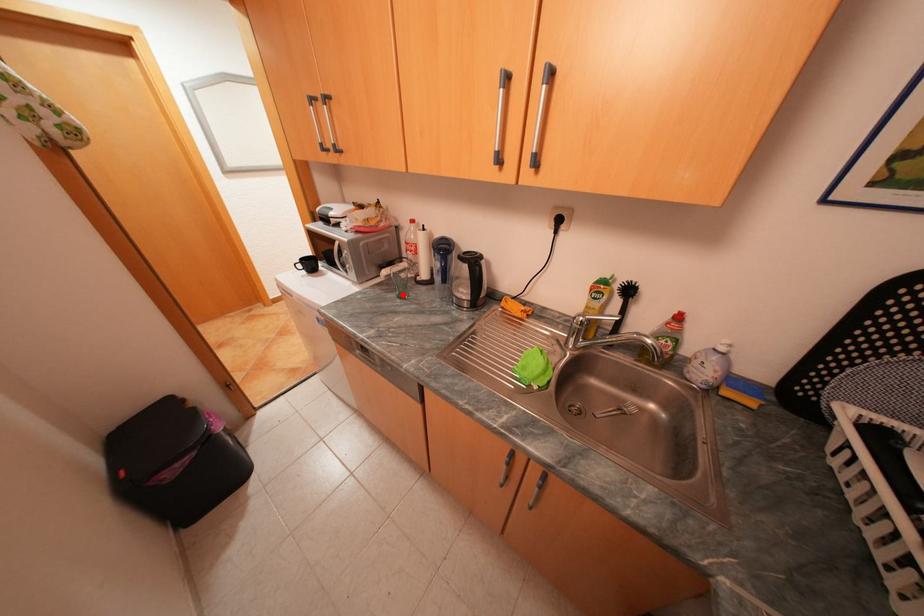
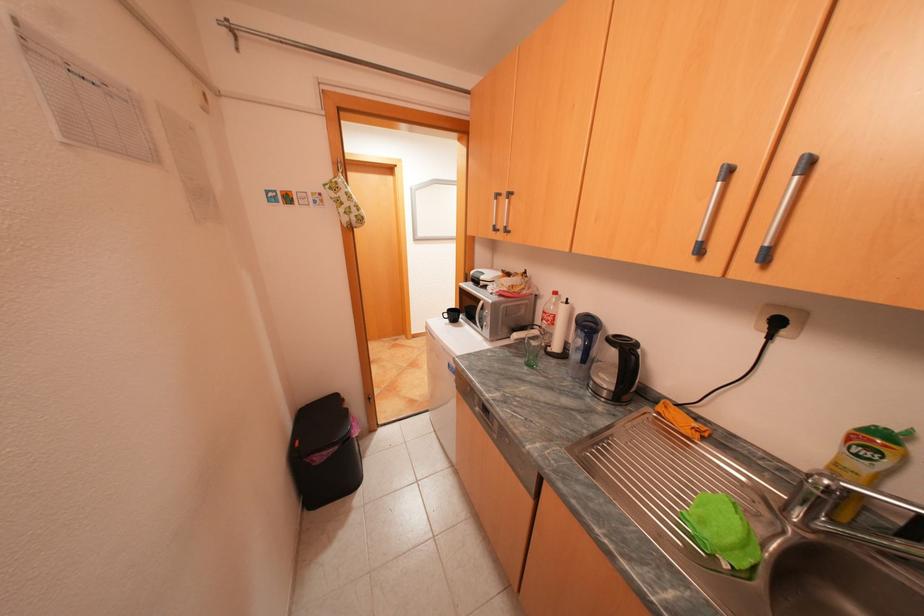
In the second image, find the point that corresponds to the highlighted location in the first image.

(530, 360)